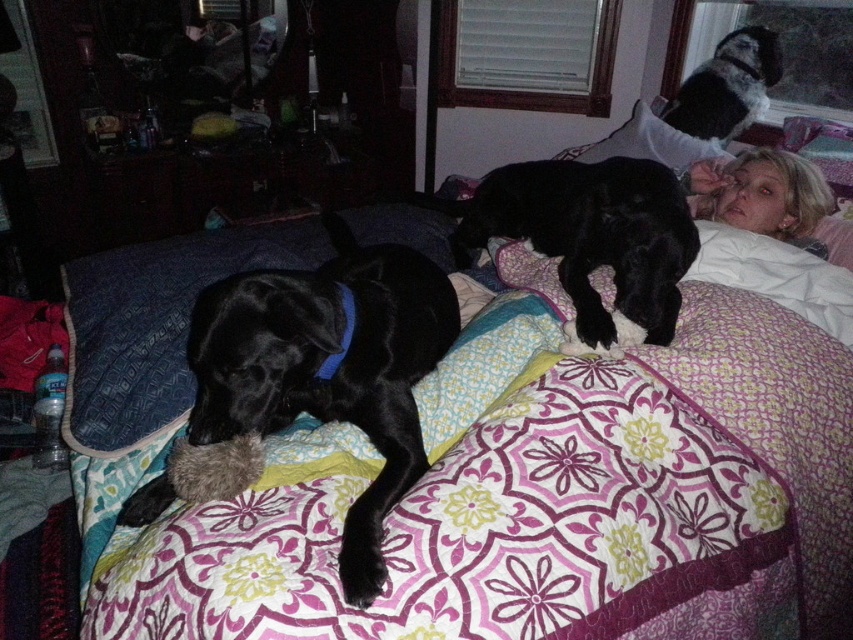
Question: Which point is closer to the camera taking this photo?

Choices:
 (A) (793, 157)
 (B) (469, 196)
 (C) (326, 266)

Answer: (C)

Question: Which object appears closest to the camera in this image?

Choices:
 (A) matte black dog at left
 (B) floral-patterned quilt at center
 (C) blonde hair at upper right

Answer: (B)

Question: Among these points, which one is nearest to the camera?

Choices:
 (A) (802, 228)
 (B) (496, 316)
 (C) (637, 156)

Answer: (B)

Question: Is shiny black dog at center to the left of fluffy white pillow at upper right from the viewer's perspective?

Choices:
 (A) no
 (B) yes

Answer: (B)

Question: Is floral-patterned quilt at center in front of fluffy white pillow at upper right?

Choices:
 (A) yes
 (B) no

Answer: (A)

Question: Considering the relative positions of shiny black dog at center and fluffy white pillow at upper right in the image provided, where is shiny black dog at center located with respect to fluffy white pillow at upper right?

Choices:
 (A) right
 (B) left

Answer: (B)